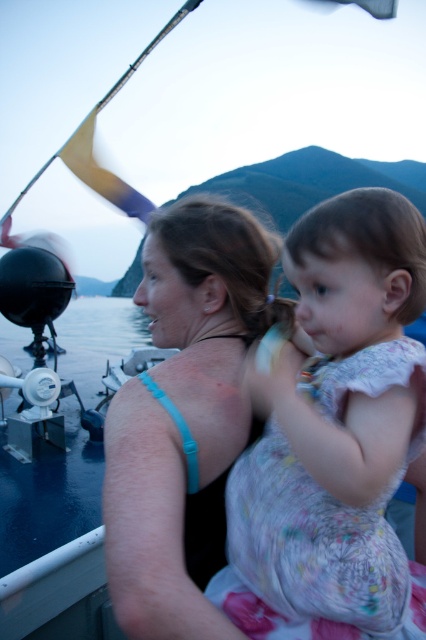
Question: Can you confirm if floral dress at center is positioned below blue fabric top at center?

Choices:
 (A) yes
 (B) no

Answer: (A)

Question: Can you confirm if floral dress at center is wider than blue fabric top at center?

Choices:
 (A) no
 (B) yes

Answer: (B)

Question: Which point is closer to the camera taking this photo?

Choices:
 (A) (249, 419)
 (B) (345, 486)

Answer: (B)

Question: Does floral dress at center have a smaller size compared to blue fabric top at center?

Choices:
 (A) no
 (B) yes

Answer: (B)